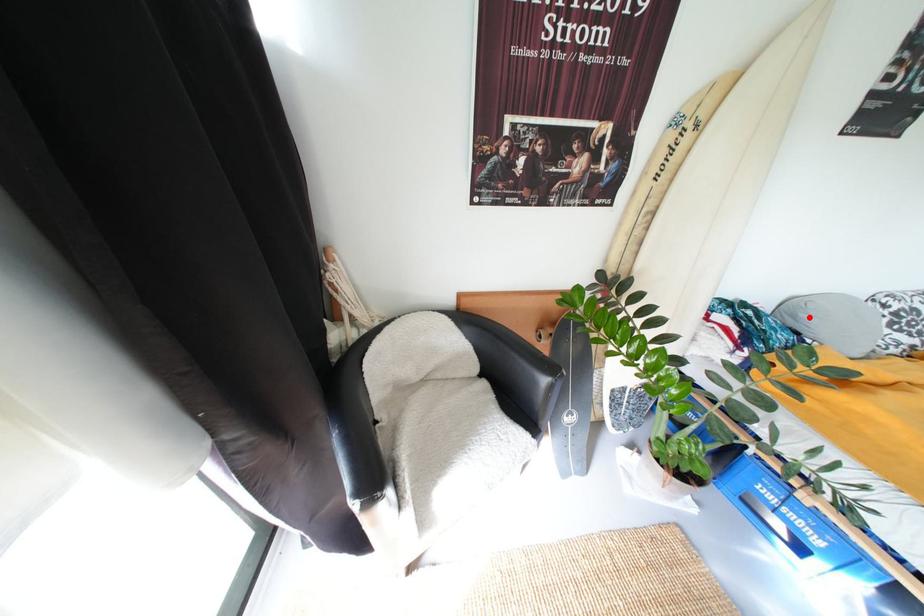
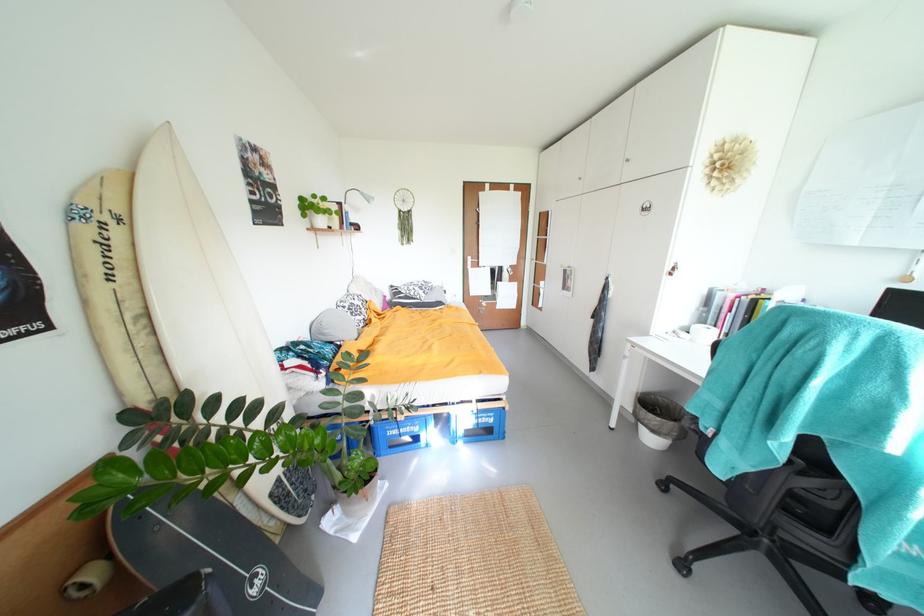
Question: A red point is marked in image1. In image2, is the corresponding 3D point closer to the camera or farther? Reply with the corresponding letter.

Choices:
 (A) The corresponding 3D point is closer.
 (B) The corresponding 3D point is farther.

Answer: (A)